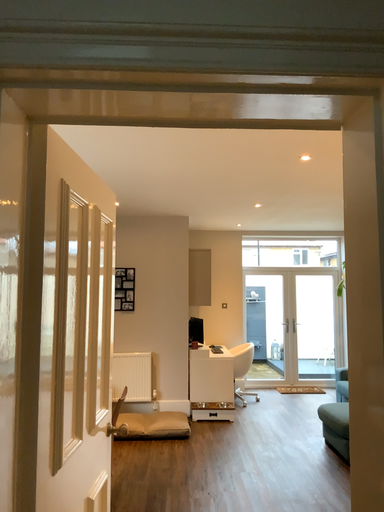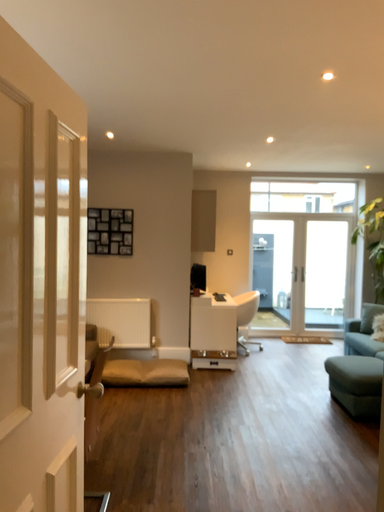
Question: Which way did the camera rotate in the video?

Choices:
 (A) rotated upward
 (B) rotated downward

Answer: (B)